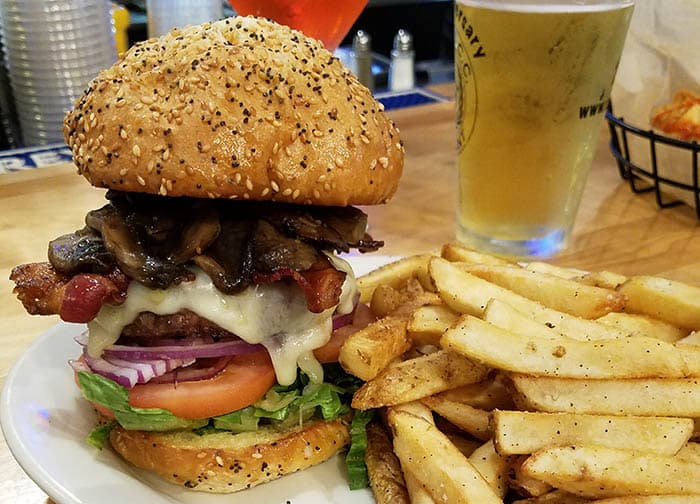
You are a GUI agent. You are given a task and a screenshot of the screen. Output one action in this format:
    pyautogui.click(x=<x>, y=<y>)
    Task: Click on the frosted mug
    
    Given the screenshot: What is the action you would take?
    pyautogui.click(x=523, y=31)